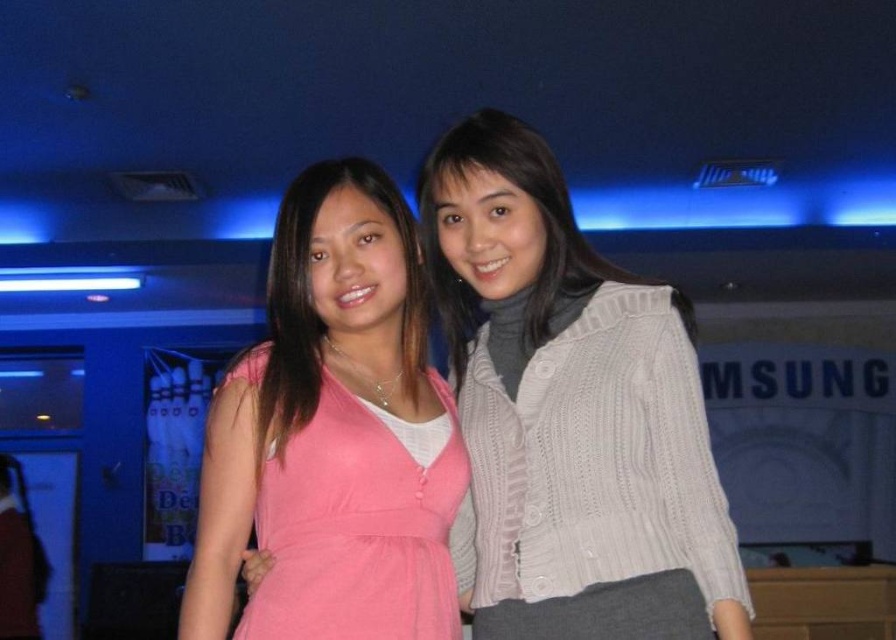
Does white knitted sweater at upper right have a smaller size compared to pink matte dress at center?

Incorrect, white knitted sweater at upper right is not smaller in size than pink matte dress at center.

Is white knitted sweater at upper right thinner than pink matte dress at center?

No.

Find the location of a particular element. This screenshot has height=640, width=896. white knitted sweater at upper right is located at coordinates (543, 230).

Between point (656, 404) and point (340, 404), which one is positioned in front?

Positioned in front is point (656, 404).

Does white knitted sweater at center appear on the right side of pink fabric dress at center?

Correct, you'll find white knitted sweater at center to the right of pink fabric dress at center.

Who is more distant from viewer, (x=645, y=499) or (x=418, y=584)?

Positioned behind is point (x=418, y=584).

You are a GUI agent. You are given a task and a screenshot of the screen. Output one action in this format:
    pyautogui.click(x=<x>, y=<y>)
    Task: Click on the white knitted sweater at center
    This screenshot has height=640, width=896.
    Given the screenshot: What is the action you would take?
    pyautogui.click(x=571, y=412)

Consider the image. Which is above, pink fabric dress at center or pink matte dress at center?

pink matte dress at center

Is pink fabric dress at center positioned behind pink matte dress at center?

No, pink fabric dress at center is in front of pink matte dress at center.

The width and height of the screenshot is (896, 640). What do you see at coordinates (358, 529) in the screenshot? I see `pink fabric dress at center` at bounding box center [358, 529].

You are a GUI agent. You are given a task and a screenshot of the screen. Output one action in this format:
    pyautogui.click(x=<x>, y=<y>)
    Task: Click on the pink fabric dress at center
    
    Given the screenshot: What is the action you would take?
    pyautogui.click(x=358, y=529)